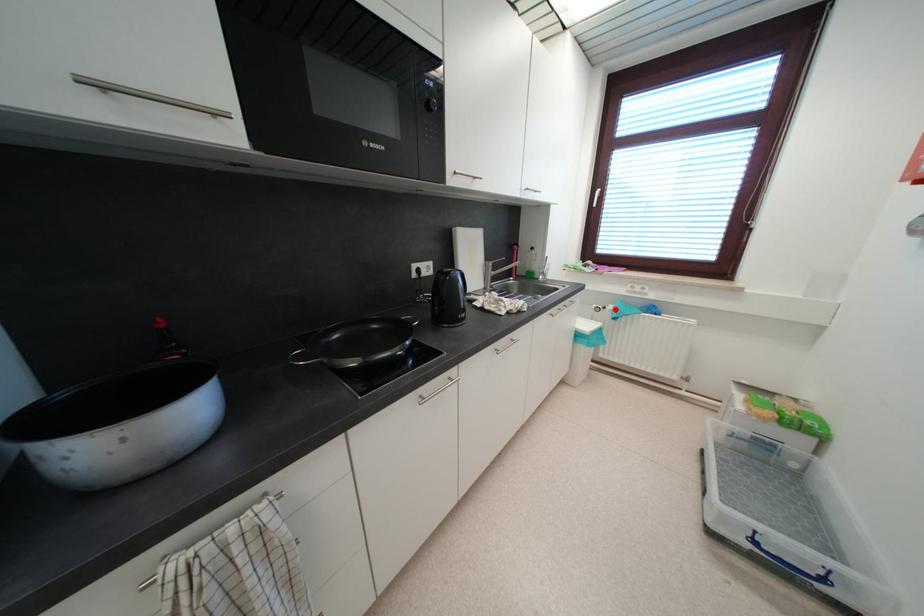
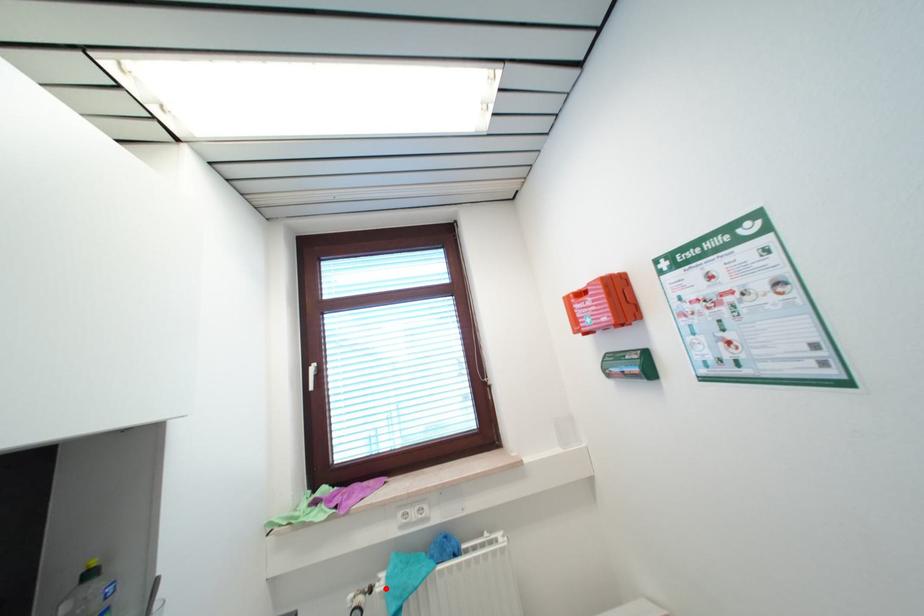
I am providing you with two images of the same scene from different viewpoints. A red point is marked on the first image and another point is marked on the second image. Is the red point in image1 aligned with the point shown in image2?

Yes